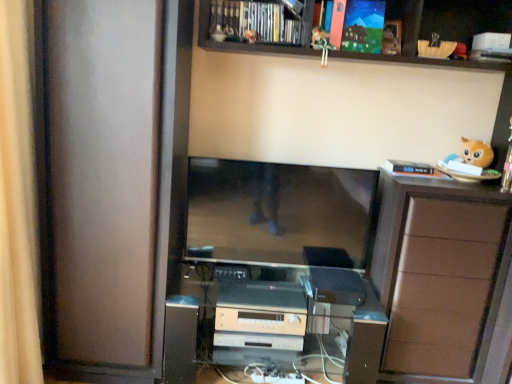
Question: Is matte black monitor at center situated inside fluffy orange plush at upper right, the 2th toy positioned from the top, or outside?

Choices:
 (A) outside
 (B) inside

Answer: (A)

Question: Is matte black monitor at center taller or shorter than fluffy orange plush at upper right, which is counted as the 1th toy, starting from the bottom?

Choices:
 (A) short
 (B) tall

Answer: (B)

Question: Which object is positioned closest to the wooden at upper center?

Choices:
 (A) matte brown screen door at left
 (B) satin silver stereo at center
 (C) matte black monitor at center
 (D) beige fabric curtain at left
 (E) beige plastic stereo at lower center, the second appliance viewed from the right

Answer: (C)

Question: Considering the real-world distances, which object is farthest from the fluffy orange plush at upper right, the 2th toy positioned from the top?

Choices:
 (A) beige fabric curtain at left
 (B) brown wood cabinet at right
 (C) black plastic speaker at lower center, the 2th appliance when ordered from left to right
 (D) beige plastic stereo at lower center, the second appliance viewed from the right
 (E) matte black monitor at center

Answer: (A)